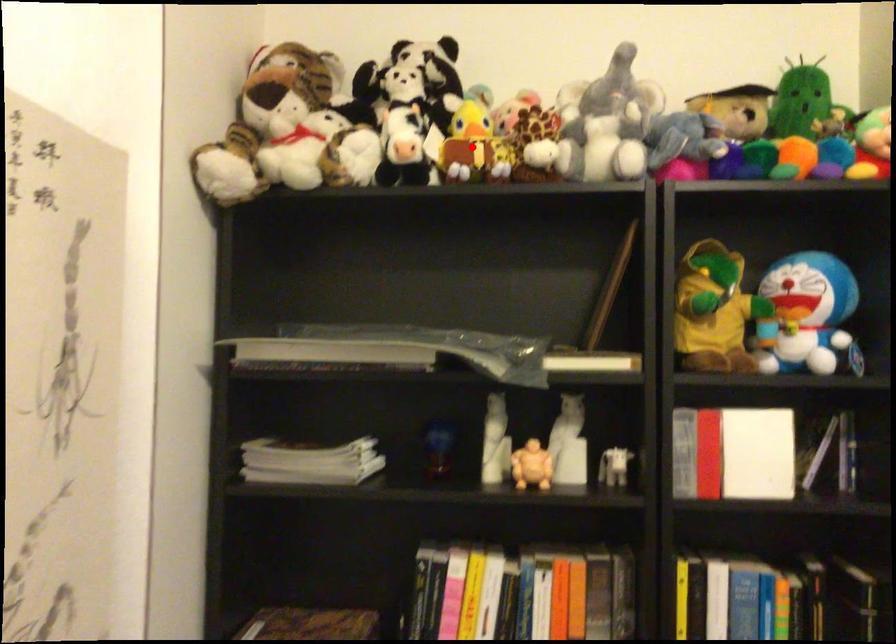
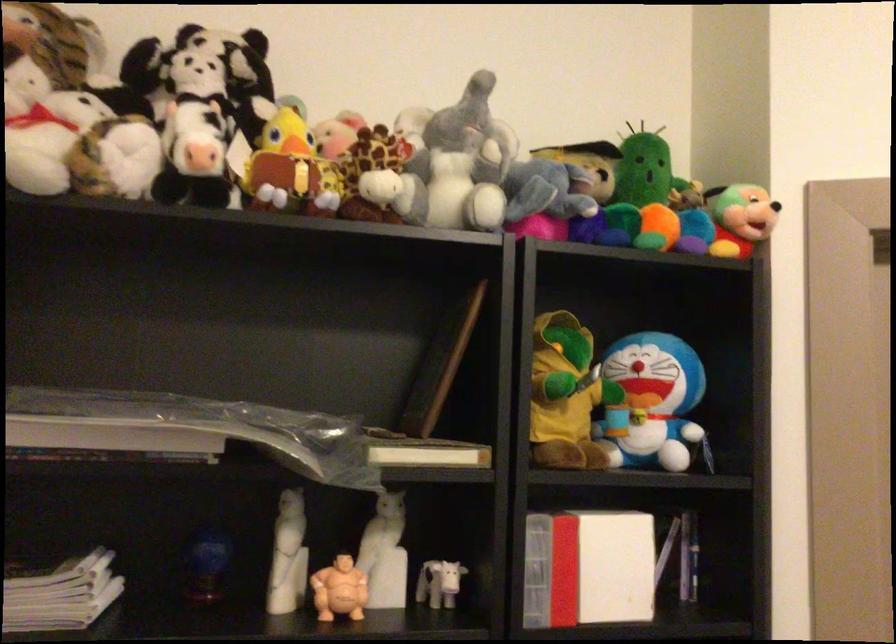
The point at the highlighted location is marked in the first image. Where is the corresponding point in the second image?

(290, 169)